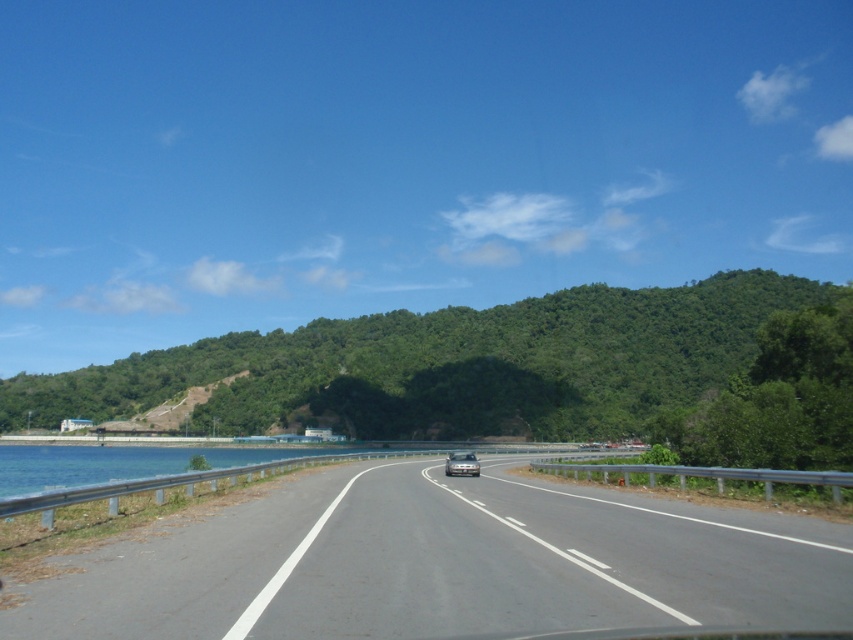
Which is above, gray asphalt highway at center or silver metallic car at center?

Positioned higher is gray asphalt highway at center.

Is point (519, 513) positioned in front of point (454, 452)?

Yes, point (519, 513) is in front of point (454, 452).

Identify the location of gray asphalt highway at center. This screenshot has width=853, height=640. (445, 564).